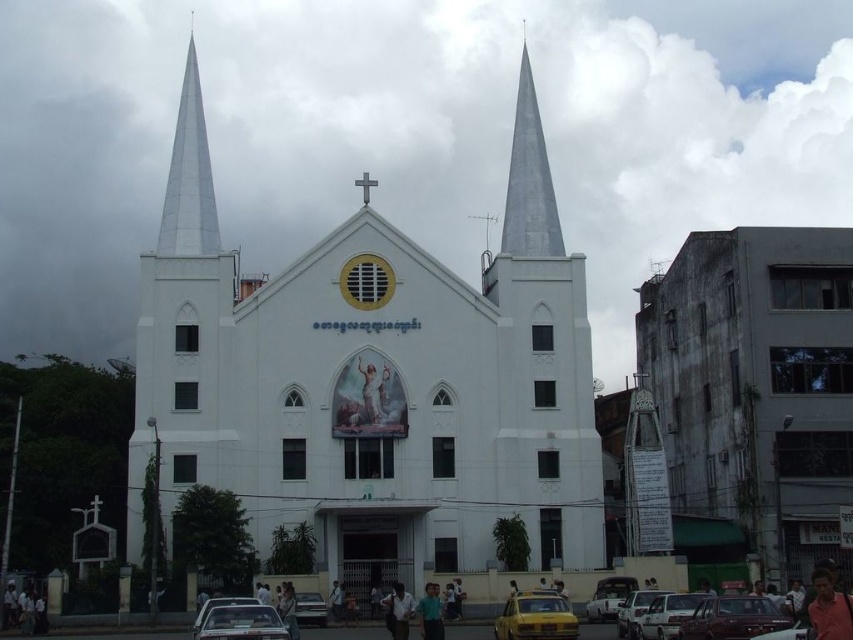
Question: Among these points, which one is farthest from the camera?

Choices:
 (A) (612, 616)
 (B) (820, 605)
 (C) (450, 408)
 (D) (374, 400)

Answer: (C)

Question: Is light blue shirt at center smaller than light brown leather jacket at center?

Choices:
 (A) yes
 (B) no

Answer: (B)

Question: Does white concrete church at right appear over yellow matte taxi at lower center?

Choices:
 (A) no
 (B) yes

Answer: (B)

Question: Which point appears closest to the camera in this image?

Choices:
 (A) (380, 385)
 (B) (637, 600)

Answer: (B)

Question: Is white matte van at center positioned in front of metallic silver car at center?

Choices:
 (A) no
 (B) yes

Answer: (B)

Question: Among these objects, which one is farthest from the camera?

Choices:
 (A) dark blue shirt at center
 (B) green fabric shirt at lower right
 (C) white matte car at center

Answer: (C)